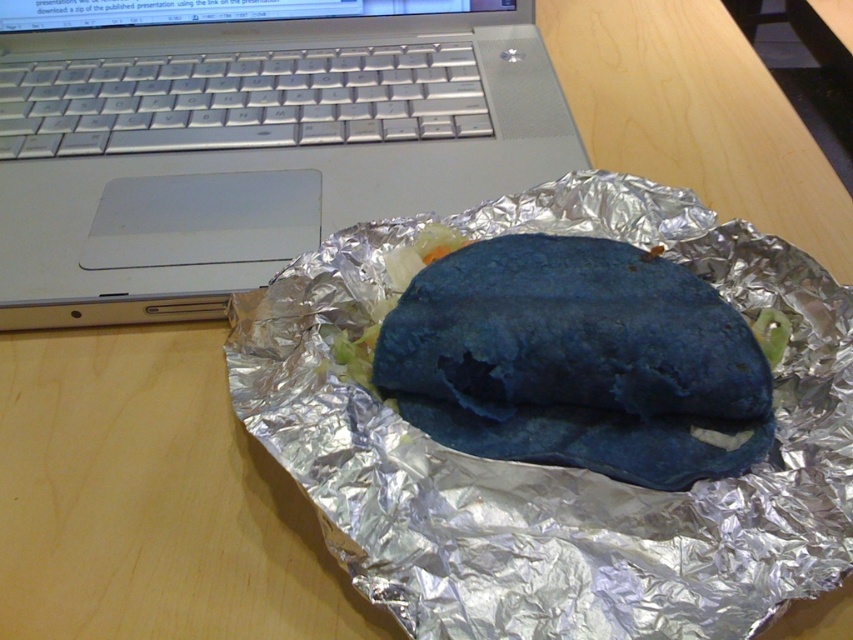
Can you confirm if silver metallic laptop at upper left is positioned to the left of shiny metallic foil at center?

Indeed, silver metallic laptop at upper left is positioned on the left side of shiny metallic foil at center.

Between silver metallic laptop at upper left and shiny metallic foil at center, which one is positioned lower?

Positioned lower is shiny metallic foil at center.

Who is more forward, (289, 208) or (422, 438)?

Point (422, 438) is in front.

Locate an element on the screen. This screenshot has width=853, height=640. silver metallic laptop at upper left is located at coordinates (247, 138).

Is point (294, 192) less distant than point (456, 410)?

No, (294, 192) is further to viewer.

Is silver metallic laptop at upper left positioned behind blue matte burrito at center?

Yes, it is behind blue matte burrito at center.

This screenshot has width=853, height=640. Identify the location of silver metallic laptop at upper left. coord(247,138).

Does shiny metallic foil at center have a larger size compared to blue matte burrito at center?

Yes.

Does point (747, 568) come in front of point (416, 364)?

Yes, it is in front of point (416, 364).

At what (x,y) coordinates should I click in order to perform the action: click on shiny metallic foil at center. Please return your answer as a coordinate pair (x, y). Image resolution: width=853 pixels, height=640 pixels. Looking at the image, I should click on (553, 467).